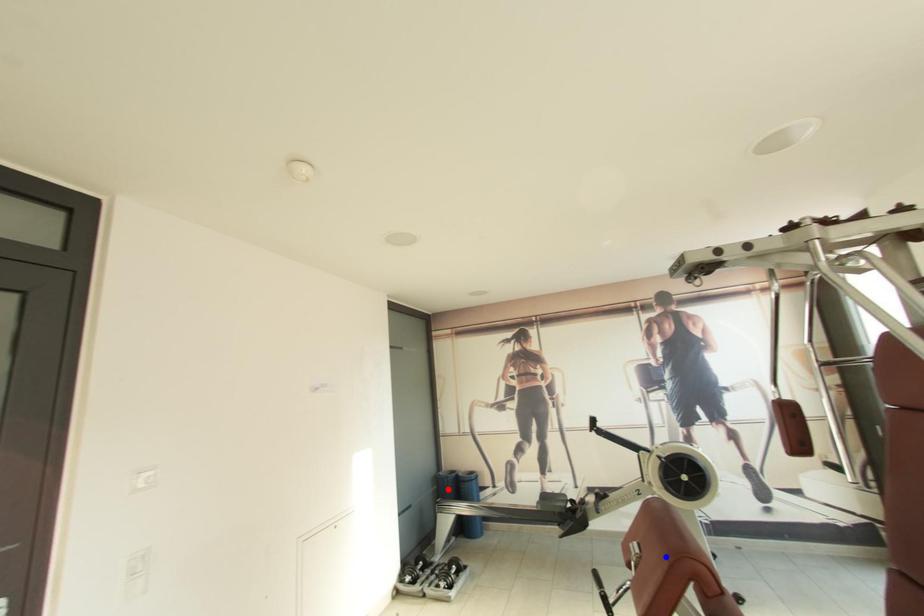
Question: In the image, two points are highlighted. Which point is nearer to the camera? Reply with the corresponding letter.

Choices:
 (A) blue point
 (B) red point

Answer: (A)